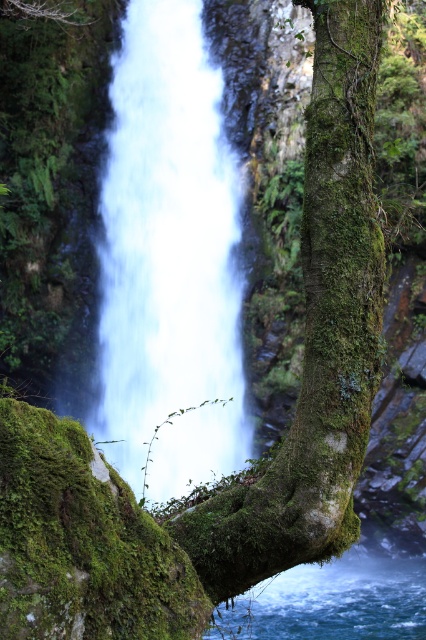
Question: Which object appears closest to the camera in this image?

Choices:
 (A) white frothy water at center
 (B) green mossy tree trunk at center

Answer: (B)

Question: Is green mossy tree trunk at center positioned in front of clear blue water at lower center?

Choices:
 (A) yes
 (B) no

Answer: (A)

Question: Which object is farther from the camera taking this photo?

Choices:
 (A) clear blue water at lower center
 (B) white frothy water at center

Answer: (B)

Question: Which is nearer to the white frothy water at center?

Choices:
 (A) green mossy tree trunk at center
 (B) clear blue water at lower center

Answer: (B)

Question: Is the position of white frothy water at center less distant than that of green mossy tree trunk at center?

Choices:
 (A) no
 (B) yes

Answer: (A)

Question: Considering the relative positions of white frothy water at center and green mossy tree trunk at center in the image provided, where is white frothy water at center located with respect to green mossy tree trunk at center?

Choices:
 (A) below
 (B) above

Answer: (A)